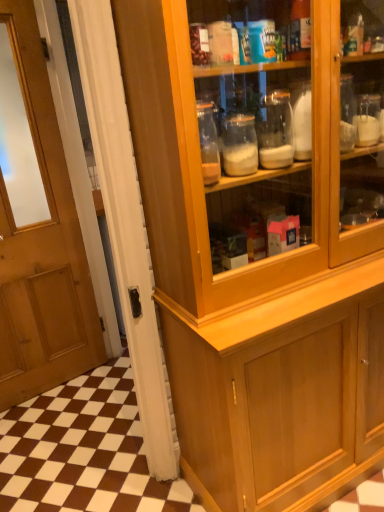
This screenshot has height=512, width=384. I want to click on free spot below wooden door at left (from a real-world perspective), so coord(118,496).